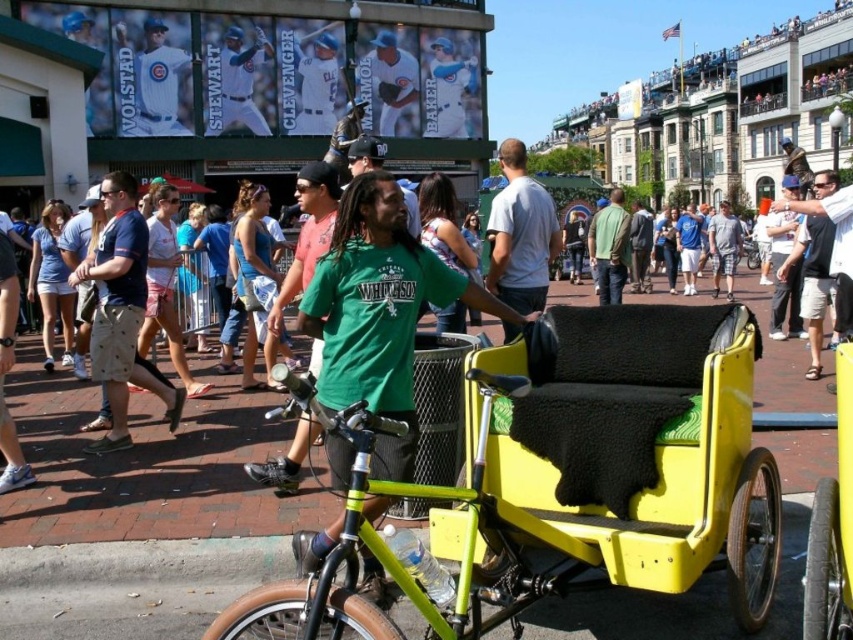
Which is in front, point (845, 305) or point (610, 218)?

Point (845, 305) is more forward.

Who is positioned more to the right, light blue shirt at center or green cotton shirt at center?

Positioned to the right is light blue shirt at center.

Looking at this image, who is more forward, (x=840, y=312) or (x=596, y=264)?

Point (x=840, y=312)

In order to click on light blue shirt at center in this screenshot , I will do `click(834, 248)`.

Who is positioned more to the right, light blue shirt at center or dark gray jacket at center?

Positioned to the right is light blue shirt at center.

How much distance is there between light blue shirt at center and dark gray jacket at center?

light blue shirt at center is 22.31 meters from dark gray jacket at center.

Is point (843, 195) positioned before point (635, 275)?

Yes, it is in front of point (635, 275).

The width and height of the screenshot is (853, 640). In order to click on light blue shirt at center in this screenshot , I will do `click(834, 248)`.

Identify the location of green cotton shirt at center. The image size is (853, 640). (608, 248).

Image resolution: width=853 pixels, height=640 pixels. What do you see at coordinates (608, 248) in the screenshot? I see `green cotton shirt at center` at bounding box center [608, 248].

Does point (596, 273) lie behind point (732, 298)?

Yes, it is.

The height and width of the screenshot is (640, 853). What are the coordinates of `green cotton shirt at center` in the screenshot? It's located at (608, 248).